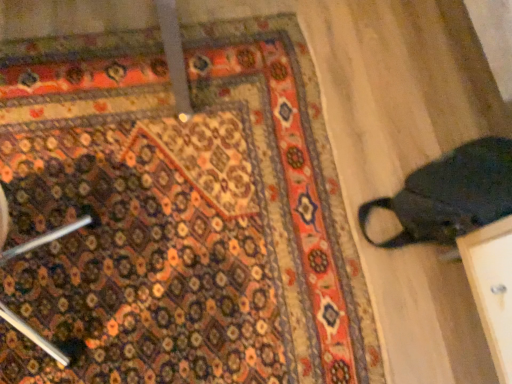
Question: Does point (415, 210) appear closer or farther from the camera than point (181, 264)?

Choices:
 (A) farther
 (B) closer

Answer: (B)

Question: Considering the positions of dark fabric bag at right and carpeted mat at lower left in the image, is dark fabric bag at right bigger or smaller than carpeted mat at lower left?

Choices:
 (A) big
 (B) small

Answer: (A)

Question: Is dark fabric bag at right taller or shorter than carpeted mat at lower left?

Choices:
 (A) short
 (B) tall

Answer: (B)

Question: From a real-world perspective, is carpeted mat at lower left positioned above or below dark fabric bag at right?

Choices:
 (A) above
 (B) below

Answer: (B)

Question: Considering the positions of carpeted mat at lower left and dark fabric bag at right in the image, is carpeted mat at lower left taller or shorter than dark fabric bag at right?

Choices:
 (A) short
 (B) tall

Answer: (A)

Question: Is carpeted mat at lower left wider or thinner than dark fabric bag at right?

Choices:
 (A) thin
 (B) wide

Answer: (B)

Question: Based on their sizes in the image, would you say carpeted mat at lower left is bigger or smaller than dark fabric bag at right?

Choices:
 (A) big
 (B) small

Answer: (B)